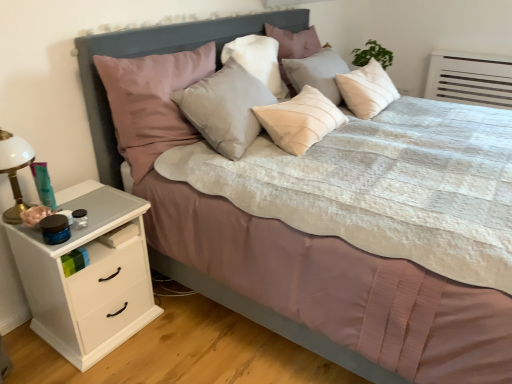
What do you see at coordinates (293, 47) in the screenshot? The height and width of the screenshot is (384, 512). I see `light beige fabric pillow at center, which appears as the 3th pillow when viewed from the left` at bounding box center [293, 47].

Locate an element on the screen. The width and height of the screenshot is (512, 384). matte gray headboard at center is located at coordinates (158, 53).

Find the location of `matte gray pillow at center, which appears as the 2th pillow when viewed from the left`. matte gray pillow at center, which appears as the 2th pillow when viewed from the left is located at coordinates (258, 60).

This screenshot has width=512, height=384. What are the coordinates of `white matte chest of drawers at left` in the screenshot? It's located at (88, 277).

Is point (122, 152) farther from viewer compared to point (104, 212)?

Yes, point (122, 152) is farther from viewer.

Could you tell me if velvet pink pillow at upper left, the third pillow positioned from the right, is facing white matte chest of drawers at left?

No, velvet pink pillow at upper left, the third pillow positioned from the right, is not facing towards white matte chest of drawers at left.

Can you tell me how much velvet pink pillow at upper left, the third pillow positioned from the right, and white matte chest of drawers at left differ in facing direction?

The angle between the facing direction of velvet pink pillow at upper left, the third pillow positioned from the right, and the facing direction of white matte chest of drawers at left is 0.353 degrees.

Consider the image. In the image, is velvet pink pillow at upper left, the third pillow positioned from the right, positioned in front of or behind white matte chest of drawers at left?

Visually, velvet pink pillow at upper left, the third pillow positioned from the right, is located behind white matte chest of drawers at left.

Considering the sizes of white glass lamp at left and matte gray pillow at center, which appears as the 2th pillow when viewed from the left, in the image, is white glass lamp at left wider or thinner than matte gray pillow at center, which appears as the 2th pillow when viewed from the left,?

In the image, white glass lamp at left appears to be more narrow than matte gray pillow at center, which appears as the 2th pillow when viewed from the left.

Considering the relative positions of white glass lamp at left and matte gray pillow at center, the second pillow when ordered from right to left, in the image provided, is white glass lamp at left to the right of matte gray pillow at center, the second pillow when ordered from right to left, from the viewer's perspective?

Incorrect, white glass lamp at left is not on the right side of matte gray pillow at center, the second pillow when ordered from right to left.

From a real-world perspective, is white glass lamp at left positioned under matte gray pillow at center, the second pillow when ordered from right to left, based on gravity?

Yes.

Could you measure the distance between white glass lamp at left and matte gray pillow at center, the second pillow when ordered from right to left?

white glass lamp at left is 4.54 feet away from matte gray pillow at center, the second pillow when ordered from right to left.

Is white matte chest of drawers at left taller than white glass lamp at left?

Indeed, white matte chest of drawers at left has a greater height compared to white glass lamp at left.

Does white matte chest of drawers at left touch white glass lamp at left?

No, white matte chest of drawers at left is not making contact with white glass lamp at left.

Is white matte chest of drawers at left turned away from white glass lamp at left?

white matte chest of drawers at left does not have its back to white glass lamp at left.

Is white matte chest of drawers at left located outside white glass lamp at left?

Yes, white matte chest of drawers at left is outside of white glass lamp at left.

Where is `pillow above the matte gray pillow at center, which appears as the 2th pillow when viewed from the left (from a real-world perspective)`? Image resolution: width=512 pixels, height=384 pixels. pillow above the matte gray pillow at center, which appears as the 2th pillow when viewed from the left (from a real-world perspective) is located at coordinates (293, 47).

Between matte gray pillow at center, the second pillow when ordered from right to left, and light beige fabric pillow at center, which appears as the 3th pillow when viewed from the left, which one has smaller width?

matte gray pillow at center, the second pillow when ordered from right to left, is thinner.

Who is shorter, matte gray pillow at center, which appears as the 2th pillow when viewed from the left, or light beige fabric pillow at center, which ranks as the 1th pillow in right-to-left order?

matte gray pillow at center, which appears as the 2th pillow when viewed from the left, is shorter.

Is point (136, 100) closer or farther from the camera than point (281, 90)?

Point (136, 100) is positioned closer to the camera compared to point (281, 90).

From a real-world perspective, which object stands above the other?

In real-world perspective, matte gray pillow at center, which appears as the 2th pillow when viewed from the left, is above.

From the image's perspective, is velvet pink pillow at upper left, the third pillow positioned from the right, over matte gray pillow at center, which appears as the 2th pillow when viewed from the left?

No.

Considering the sizes of objects velvet pink pillow at upper left, the third pillow positioned from the right, and matte gray pillow at center, the second pillow when ordered from right to left, in the image provided, who is smaller, velvet pink pillow at upper left, the third pillow positioned from the right, or matte gray pillow at center, the second pillow when ordered from right to left,?

matte gray pillow at center, the second pillow when ordered from right to left, is smaller.

Who is more distant, light beige fabric pillow at center, which ranks as the 1th pillow in right-to-left order, or white glass lamp at left?

light beige fabric pillow at center, which ranks as the 1th pillow in right-to-left order, is further away from the camera.

Are light beige fabric pillow at center, which ranks as the 1th pillow in right-to-left order, and white glass lamp at left beside each other?

No, light beige fabric pillow at center, which ranks as the 1th pillow in right-to-left order, is not with white glass lamp at left.

Is point (313, 43) closer to camera compared to point (24, 206)?

No, (313, 43) is behind (24, 206).

From a real-world perspective, who is located lower, light beige fabric pillow at center, which appears as the 3th pillow when viewed from the left, or white glass lamp at left?

From a 3D spatial view, white glass lamp at left is below.

Which of these two, white matte chest of drawers at left or matte gray pillow at center, the second pillow when ordered from right to left, stands taller?

With more height is white matte chest of drawers at left.

Can you confirm if white matte chest of drawers at left is positioned to the right of matte gray pillow at center, which appears as the 2th pillow when viewed from the left?

No, white matte chest of drawers at left is not to the right of matte gray pillow at center, which appears as the 2th pillow when viewed from the left.

Is matte gray pillow at center, which appears as the 2th pillow when viewed from the left, at the back of white matte chest of drawers at left?

No, white matte chest of drawers at left is not facing away from matte gray pillow at center, which appears as the 2th pillow when viewed from the left.

Does white matte chest of drawers at left contain matte gray pillow at center, which appears as the 2th pillow when viewed from the left?

That's incorrect, matte gray pillow at center, which appears as the 2th pillow when viewed from the left, is not inside white matte chest of drawers at left.

From a real-world perspective, which pillow is the 1st one above the white matte chest of drawers at left? Please provide its 2D coordinates.

[(152, 102)]

Find the location of a particular element. The width and height of the screenshot is (512, 384). bedside lamp located below the matte gray pillow at center, which appears as the 2th pillow when viewed from the left (from the image's perspective) is located at coordinates (14, 170).

When comparing their distances from matte gray headboard at center, does velvet pink pillow at upper left, the third pillow positioned from the right, or white glass lamp at left seem closer?

Based on the image, velvet pink pillow at upper left, the third pillow positioned from the right, appears to be nearer to matte gray headboard at center.

Based on their spatial positions, is matte gray pillow at center, the second pillow when ordered from right to left, or velvet pink pillow at upper left, the third pillow positioned from the right, closer to white matte chest of drawers at left?

velvet pink pillow at upper left, the third pillow positioned from the right, is closer to white matte chest of drawers at left.

From the image, which object appears to be farther from light beige fabric pillow at center, which appears as the 3th pillow when viewed from the left, matte gray pillow at center, which appears as the 2th pillow when viewed from the left, or white matte chest of drawers at left?

Based on the image, white matte chest of drawers at left appears to be further to light beige fabric pillow at center, which appears as the 3th pillow when viewed from the left.

Based on their spatial positions, is matte gray pillow at center, the second pillow when ordered from right to left, or matte gray headboard at center closer to white glass lamp at left?

matte gray headboard at center is positioned closer to the anchor white glass lamp at left.

When comparing their distances from light beige fabric pillow at center, which appears as the 3th pillow when viewed from the left, does matte gray pillow at center, which appears as the 2th pillow when viewed from the left, or white glass lamp at left seem further?

Based on the image, white glass lamp at left appears to be further to light beige fabric pillow at center, which appears as the 3th pillow when viewed from the left.

Looking at the image, which one is located further to matte gray pillow at center, the second pillow when ordered from right to left, matte gray headboard at center or velvet pink pillow at upper left, the third pillow positioned from the right?

velvet pink pillow at upper left, the third pillow positioned from the right, lies further to matte gray pillow at center, the second pillow when ordered from right to left, than the other object.

Looking at the image, which one is located closer to matte gray headboard at center, velvet pink pillow at upper left, arranged as the 1th pillow when viewed from the left, or light beige fabric pillow at center, which appears as the 3th pillow when viewed from the left?

The object closer to matte gray headboard at center is velvet pink pillow at upper left, arranged as the 1th pillow when viewed from the left.

When comparing their distances from matte gray headboard at center, does white glass lamp at left or matte gray pillow at center, the second pillow when ordered from right to left, seem closer?

matte gray pillow at center, the second pillow when ordered from right to left, is closer to matte gray headboard at center.

Find the location of a particular element. The width and height of the screenshot is (512, 384). pillow between matte gray headboard at center and white matte chest of drawers at left vertically is located at coordinates (152, 102).

Locate an element on the screen. the chest of drawers located between white glass lamp at left and matte gray headboard at center in the left-right direction is located at coordinates (88, 277).

Identify the location of headboard between matte gray pillow at center, which appears as the 2th pillow when viewed from the left, and white matte chest of drawers at left, in the vertical direction. The image size is (512, 384). (158, 53).

Where is `pillow between matte gray pillow at center, which appears as the 2th pillow when viewed from the left, and white matte chest of drawers at left in the up-down direction`? pillow between matte gray pillow at center, which appears as the 2th pillow when viewed from the left, and white matte chest of drawers at left in the up-down direction is located at coordinates (152, 102).